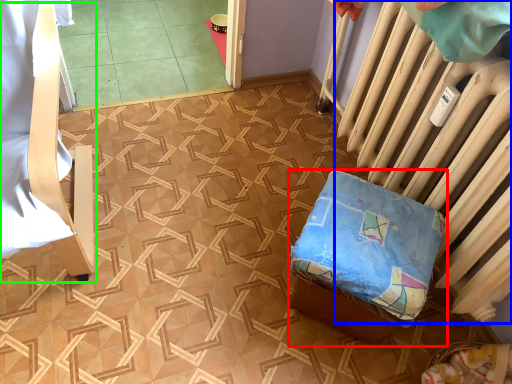
Question: Which is nearer to the furniture (highlighted by a red box)? radiator (highlighted by a blue box) or furniture (highlighted by a green box).

Choices:
 (A) radiator
 (B) furniture

Answer: (A)